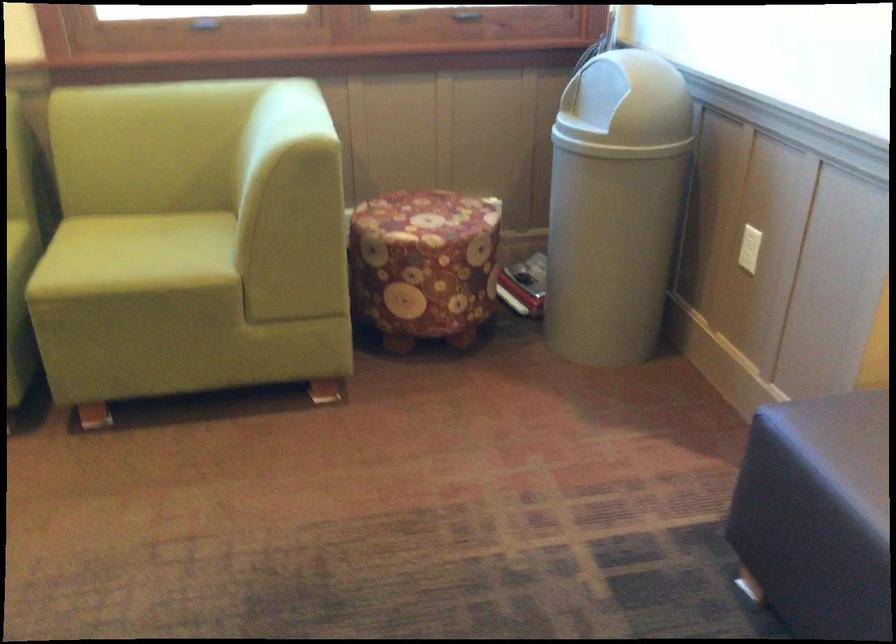
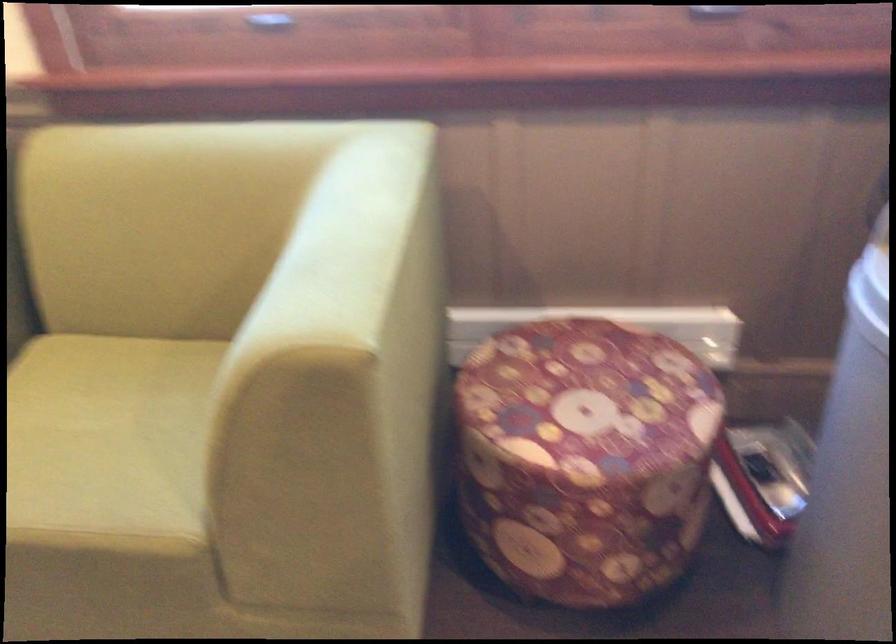
Locate, in the second image, the point that corresponds to point 143,257 in the first image.

(107, 442)